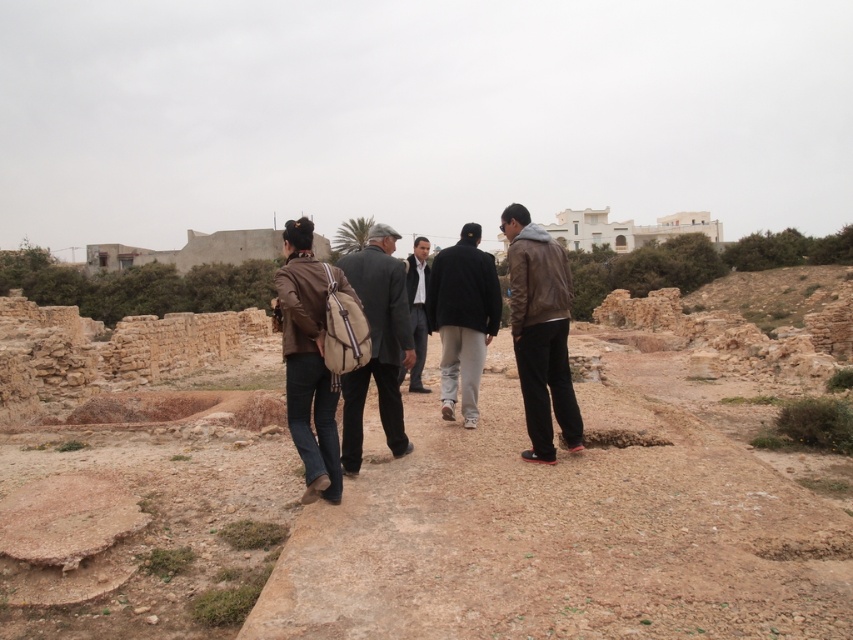
You are standing at the archaeological site and want to reach the point marked as point (445, 378). If your walking speed is 3 feet per second, how many seconds will it take you to reach that point?

The distance between you and point (445, 378) is 99.10 feet. At a walking speed of 3 feet per second, it would take approximately 33 seconds to reach the point.

You are a tour guide leading a group at the archaeological site. You notice two visitors wearing a black leather jacket at center and a dark gray suit at center. Which one is positioned to the right of the other?

The black leather jacket at center is to the right of the dark gray suit at center.

You are one of the five people walking through the archaeological site. You want to step onto the brown dirt path at center. Which direction should you move relative to your current position near the dark brown leather jacket at center?

To step onto the brown dirt path at center from near the dark brown leather jacket at center, you should move forward since the path is in front of the jacket.